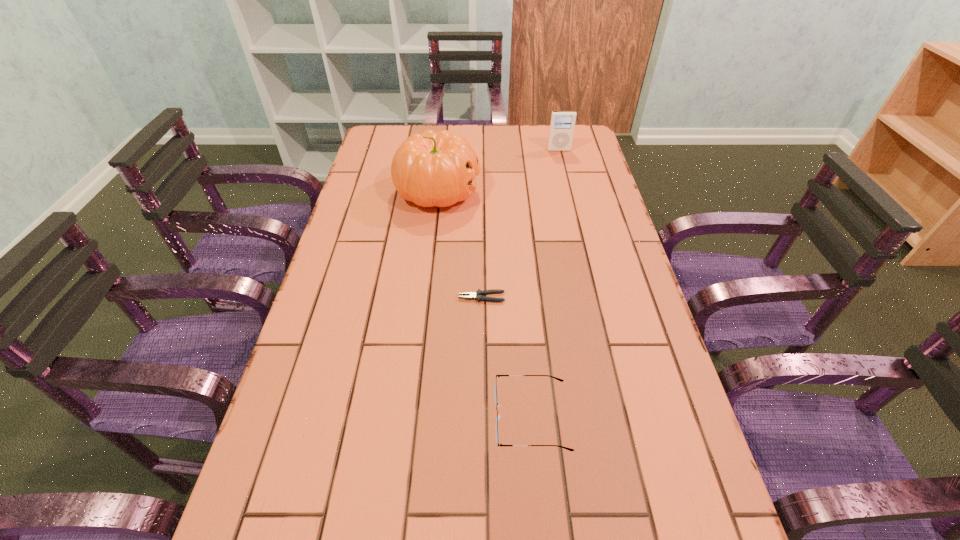
This screenshot has width=960, height=540. Find the location of `the second farthest object`. the second farthest object is located at coordinates (430, 169).

The height and width of the screenshot is (540, 960). I want to click on the tallest object, so click(x=430, y=169).

At what (x,y) coordinates should I click in order to perform the action: click on the rightmost object. Please return your answer as a coordinate pair (x, y). The width and height of the screenshot is (960, 540). Looking at the image, I should click on (562, 124).

At what (x,y) coordinates should I click in order to perform the action: click on the farthest object. Please return your answer as a coordinate pair (x, y). The height and width of the screenshot is (540, 960). Looking at the image, I should click on (562, 124).

Locate an element on the screen. the nearest object is located at coordinates (498, 416).

At what (x,y) coordinates should I click in order to perform the action: click on spectacles. Please return your answer as a coordinate pair (x, y). Looking at the image, I should click on (498, 416).

You are a GUI agent. You are given a task and a screenshot of the screen. Output one action in this format:
    pyautogui.click(x=<x>, y=<y>)
    Task: Click on the pliers
    
    Given the screenshot: What is the action you would take?
    pyautogui.click(x=477, y=295)

Locate an element on the screen. The height and width of the screenshot is (540, 960). the second nearest object is located at coordinates (477, 295).

This screenshot has height=540, width=960. Find the location of `vacant space located 0.120m on the carved face of the tallest object`. vacant space located 0.120m on the carved face of the tallest object is located at coordinates point(518,191).

Where is `free space located 0.310m on the front-facing side of the farthest object`? This screenshot has width=960, height=540. free space located 0.310m on the front-facing side of the farthest object is located at coordinates (572, 205).